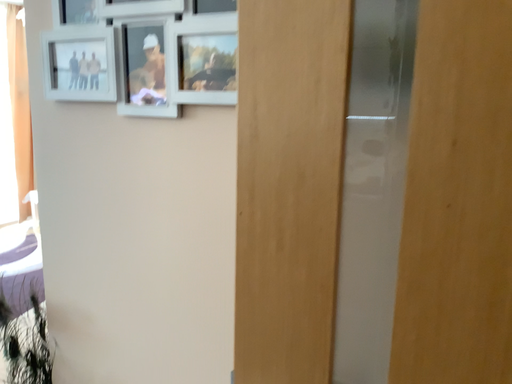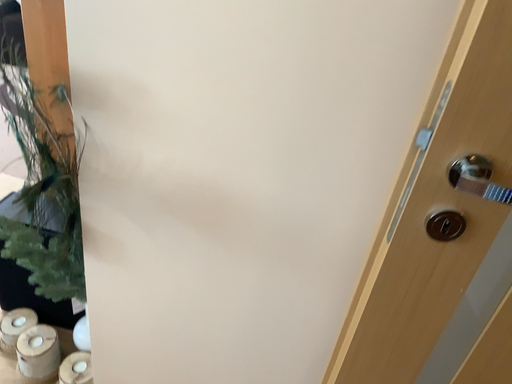
Question: How did the camera likely rotate when shooting the video?

Choices:
 (A) rotated downward
 (B) rotated upward

Answer: (A)